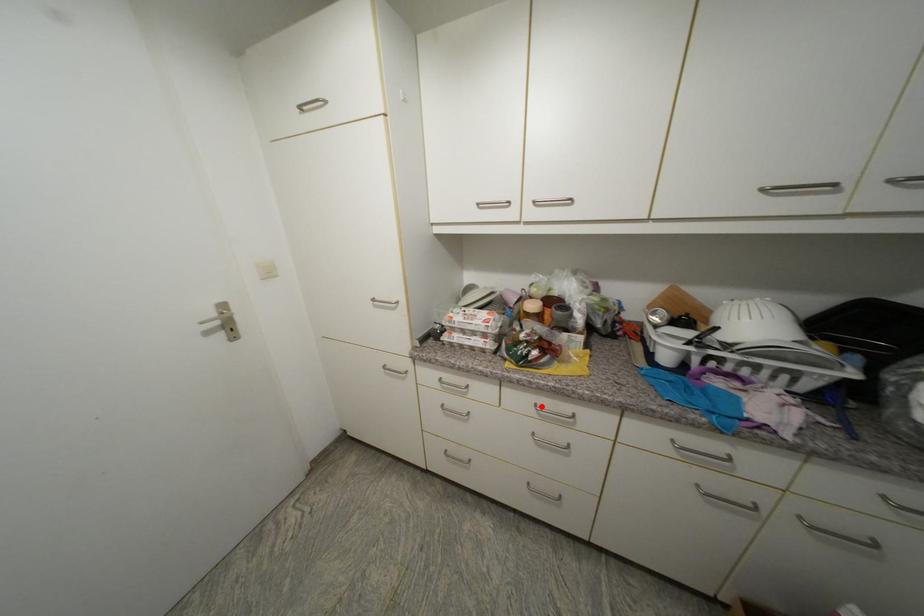
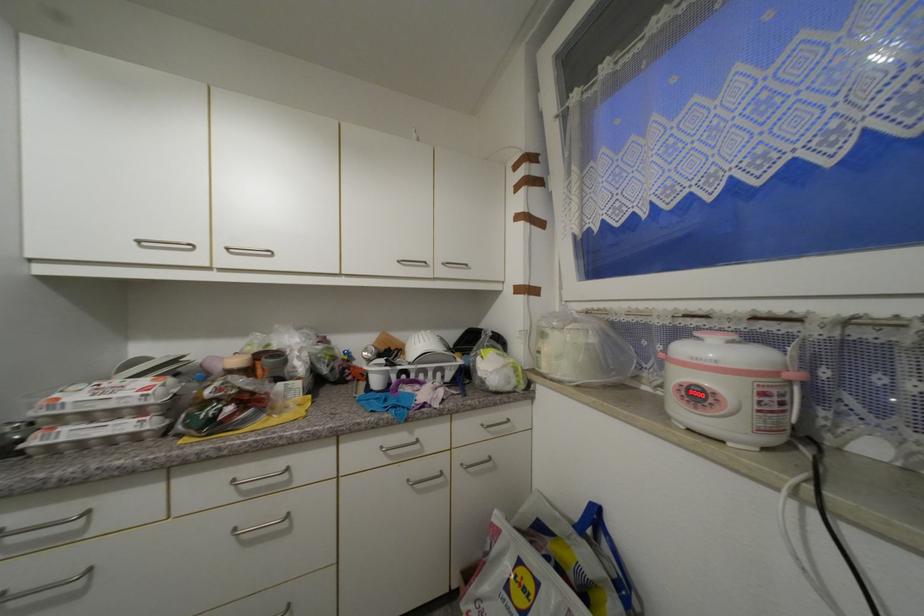
In the second image, find the point that corresponds to the highlighted location in the first image.

(238, 483)